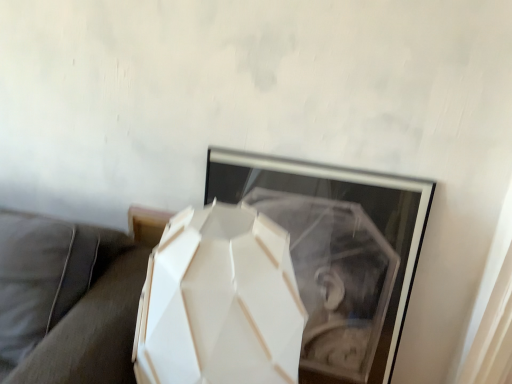
Question: From a real-world perspective, does white matte geometric lamp at center sit lower than suede gray couch at lower left?

Choices:
 (A) no
 (B) yes

Answer: (A)

Question: Is white matte geometric lamp at center at the right side of suede gray couch at lower left?

Choices:
 (A) no
 (B) yes

Answer: (B)

Question: Is white matte geometric lamp at center not inside suede gray couch at lower left?

Choices:
 (A) no
 (B) yes

Answer: (B)

Question: Is white matte geometric lamp at center to the left of suede gray couch at lower left from the viewer's perspective?

Choices:
 (A) yes
 (B) no

Answer: (B)

Question: From the image's perspective, would you say white matte geometric lamp at center is positioned over suede gray couch at lower left?

Choices:
 (A) yes
 (B) no

Answer: (A)

Question: Is white matte geometric lamp at center further to the viewer compared to suede gray couch at lower left?

Choices:
 (A) no
 (B) yes

Answer: (A)

Question: Considering the relative sizes of suede gray couch at lower left and white matte geometric lamp at center in the image provided, is suede gray couch at lower left shorter than white matte geometric lamp at center?

Choices:
 (A) no
 (B) yes

Answer: (B)

Question: Is the surface of suede gray couch at lower left in direct contact with white matte geometric lamp at center?

Choices:
 (A) yes
 (B) no

Answer: (B)

Question: Can you confirm if suede gray couch at lower left is thinner than white matte geometric lamp at center?

Choices:
 (A) yes
 (B) no

Answer: (B)

Question: From a real-world perspective, does suede gray couch at lower left stand above white matte geometric lamp at center?

Choices:
 (A) yes
 (B) no

Answer: (B)

Question: Does suede gray couch at lower left have a greater height compared to white matte geometric lamp at center?

Choices:
 (A) no
 (B) yes

Answer: (A)

Question: Is the depth of suede gray couch at lower left greater than that of white matte geometric lamp at center?

Choices:
 (A) no
 (B) yes

Answer: (B)

Question: Choose the correct answer: Is white matte geometric lamp at center inside suede gray couch at lower left or outside it?

Choices:
 (A) outside
 (B) inside

Answer: (A)